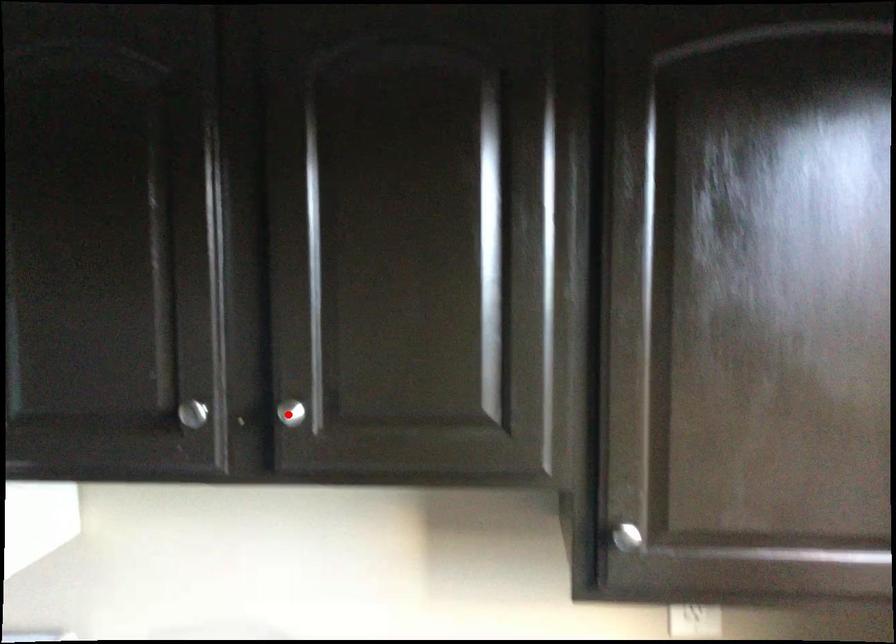
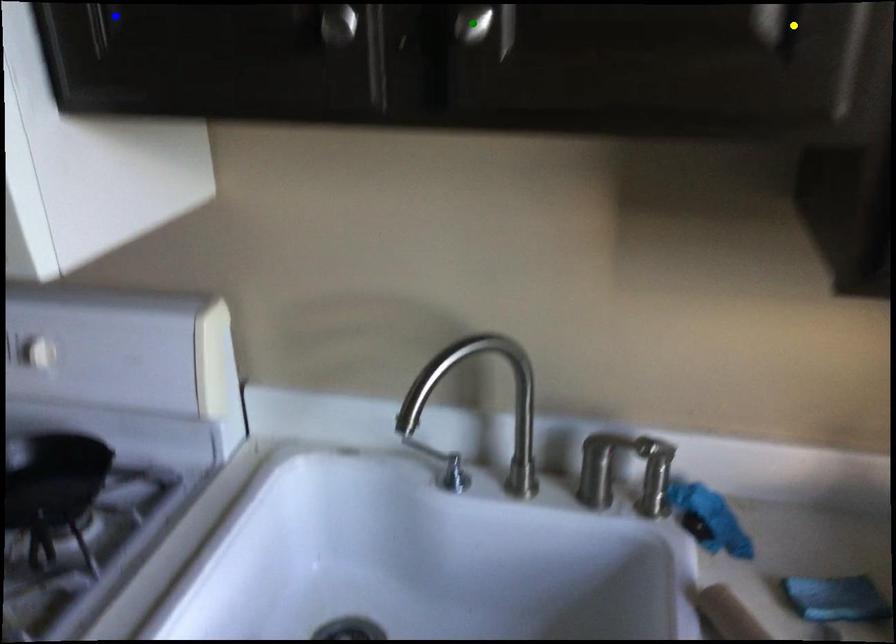
Question: I am providing you with two images of the same scene from different viewpoints. A red point is marked on the first image. You are given multiple points on the second image. Can you choose the point in image 2 that corresponds to the point in image 1?

Choices:
 (A) blue point
 (B) green point
 (C) yellow point

Answer: (B)